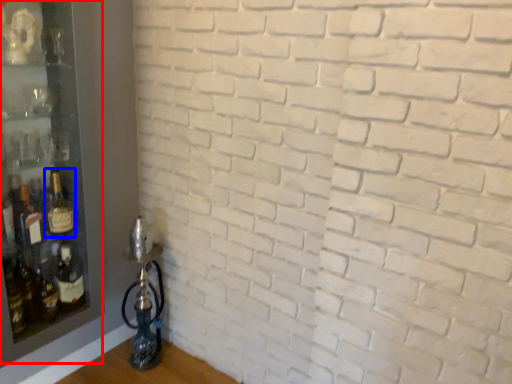
Question: Among these objects, which one is farthest to the camera, shelf (highlighted by a red box) or bottle (highlighted by a blue box)?

Choices:
 (A) shelf
 (B) bottle

Answer: (B)